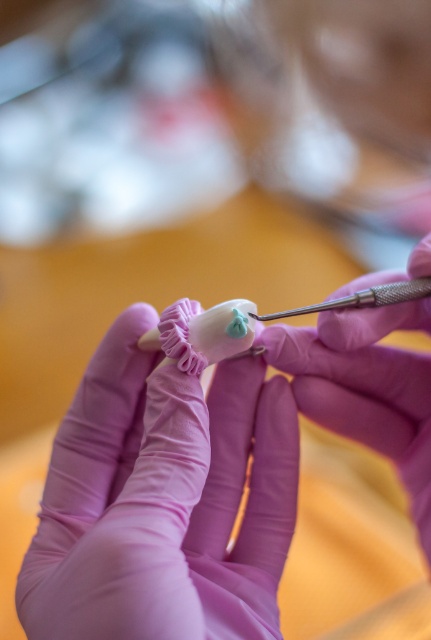
Question: Is purple rubber glove at center to the right of metallic needle at center from the viewer's perspective?

Choices:
 (A) yes
 (B) no

Answer: (B)

Question: Which of these objects is positioned farthest from the purple rubber glove at center?

Choices:
 (A) pink rubber glove at center
 (B) matte pink glove at center
 (C) metallic needle at center

Answer: (A)

Question: Which of these objects is positioned closest to the metallic needle at center?

Choices:
 (A) pink rubber glove at center
 (B) purple rubber glove at center

Answer: (B)

Question: Which object is positioned farthest from the metallic needle at center?

Choices:
 (A) purple rubber glove at center
 (B) pink rubber glove at center

Answer: (B)

Question: Is pink rubber glove at center smaller than metallic needle at center?

Choices:
 (A) yes
 (B) no

Answer: (B)

Question: In this image, where is matte pink glove at center located relative to purple rubber glove at center?

Choices:
 (A) below
 (B) above

Answer: (A)